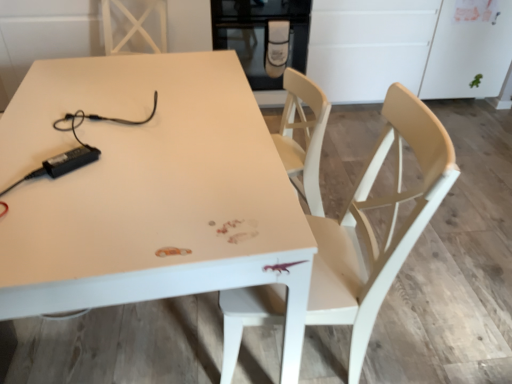
Question: Considering their positions, is light wood chair at center located in front of or behind white glossy table at center?

Choices:
 (A) behind
 (B) front

Answer: (A)

Question: Is light wood chair at center inside or outside of white glossy table at center?

Choices:
 (A) inside
 (B) outside

Answer: (A)

Question: Which object is positioned farthest from the light wood chair at center?

Choices:
 (A) black glass oven at upper center
 (B) white glossy table at center

Answer: (A)

Question: Which of these objects is positioned farthest from the light wood chair at center?

Choices:
 (A) white glossy table at center
 (B) black glass oven at upper center

Answer: (B)